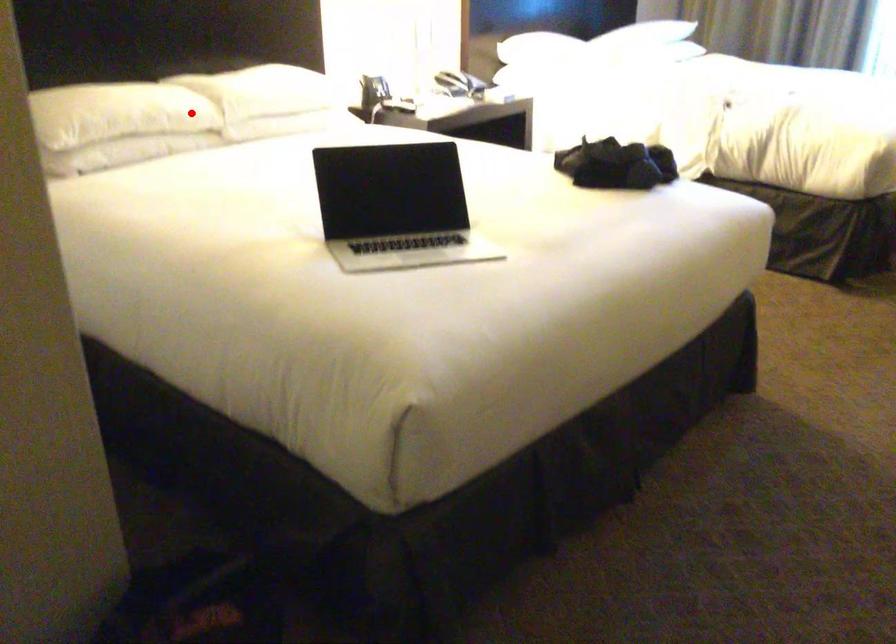
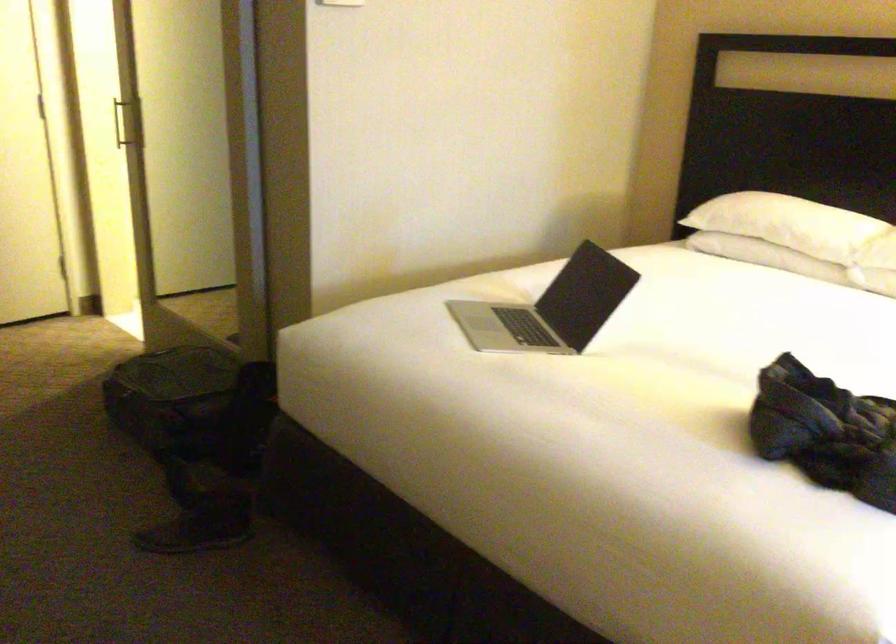
In the second image, find the point that corresponds to the highlighted location in the first image.

(788, 223)